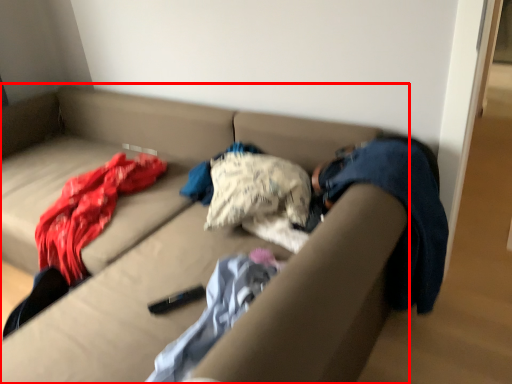
Question: From the image's perspective, where is studio couch (annotated by the red box) located in relation to blanket in the image?

Choices:
 (A) above
 (B) below

Answer: (A)